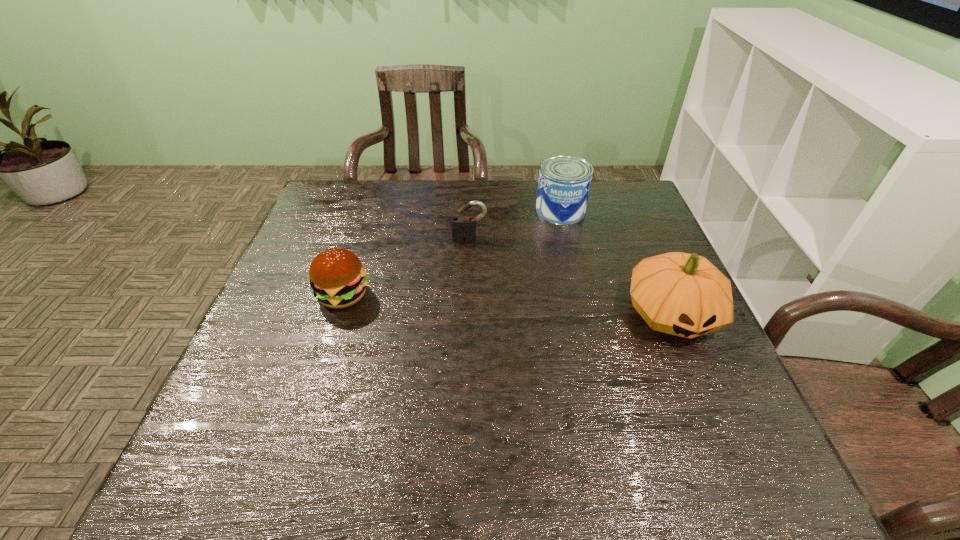
Image resolution: width=960 pixels, height=540 pixels. I want to click on vacant space on the desktop that is between the hamburger and the gourd and is positioned on the front label of the second object from right to left, so click(x=517, y=305).

Locate an element on the screen. vacant spot on the desktop that is between the hamburger and the gourd and is positioned with the keyhole on the front of the second object from left to right is located at coordinates (468, 302).